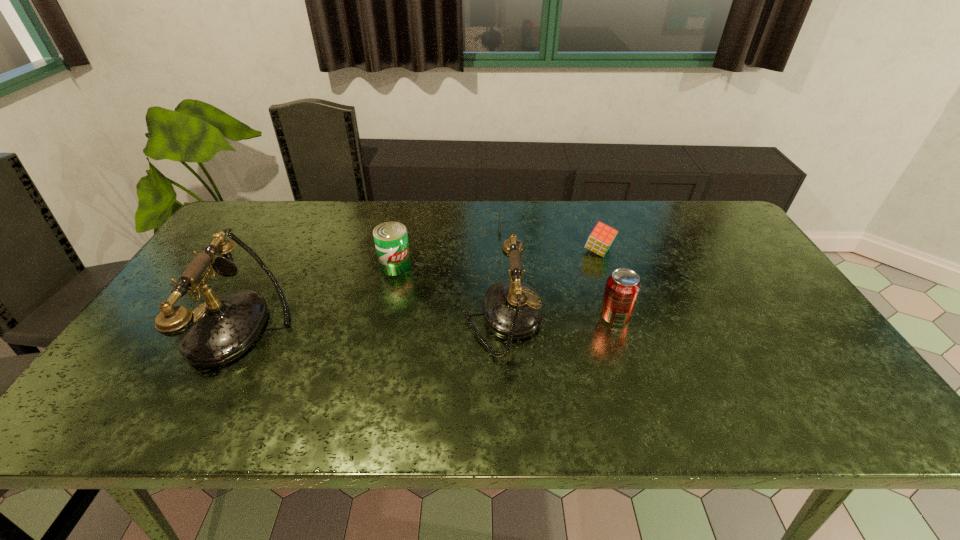
Please point a spot to add another telephone on the right. Please provide its 2D coordinates. Your answer should be formatted as a tuple, i.e. [(x, y)], where the tuple contains the x and y coordinates of a point satisfying the conditions above.

[(753, 313)]